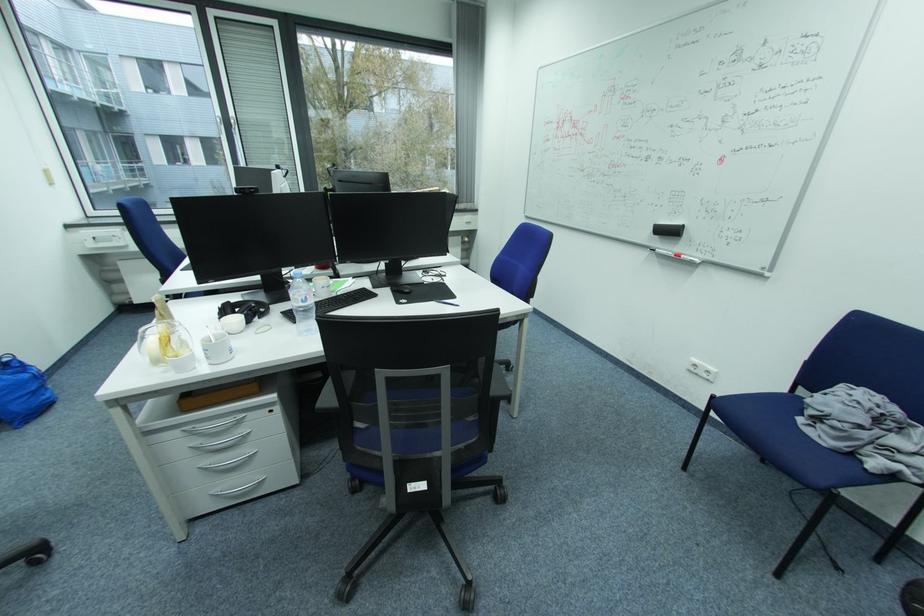
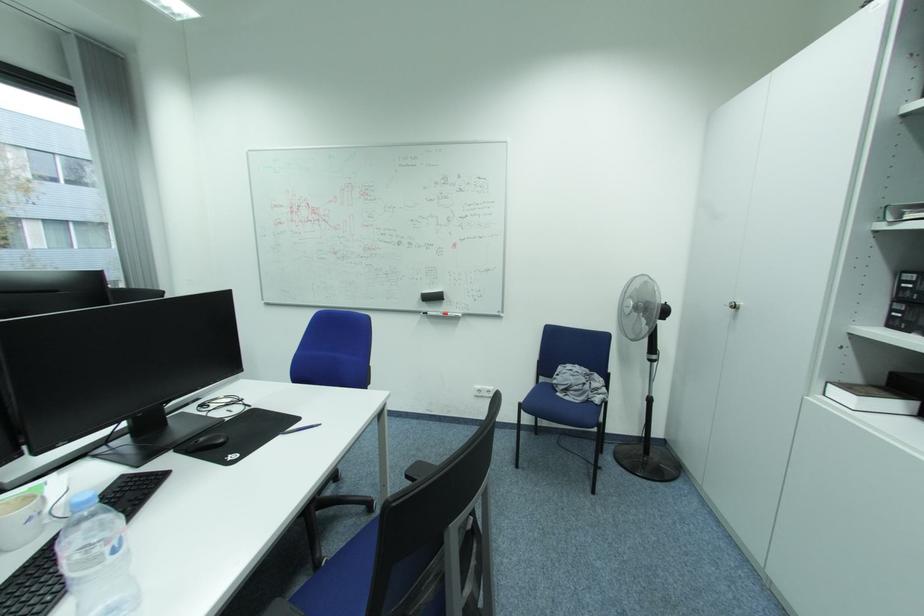
Question: The camera is either moving clockwise (left) or counter-clockwise (right) around the object. The first image is from the beginning of the video and the second image is from the end. Is the camera moving left or right when shooting the video?

Choices:
 (A) Left
 (B) Right

Answer: (A)